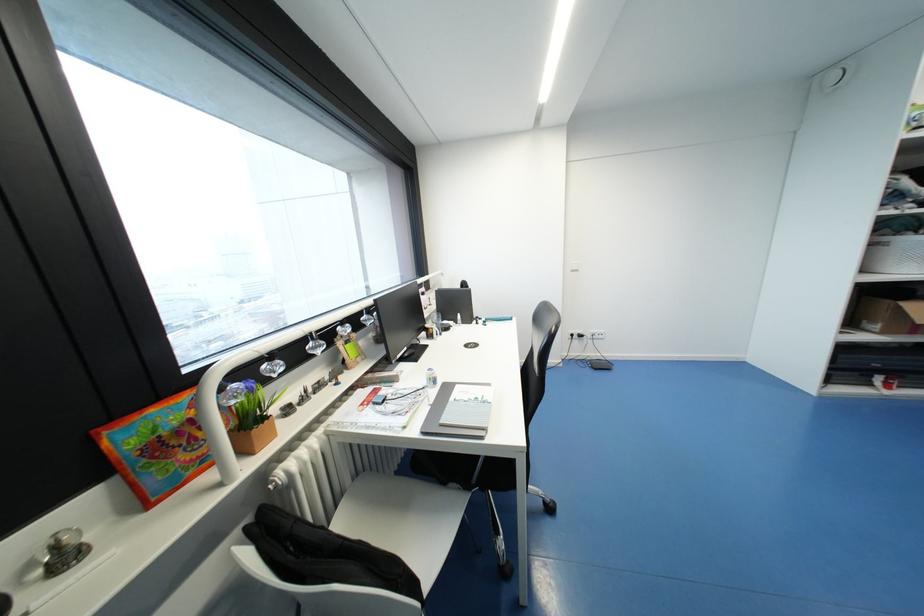
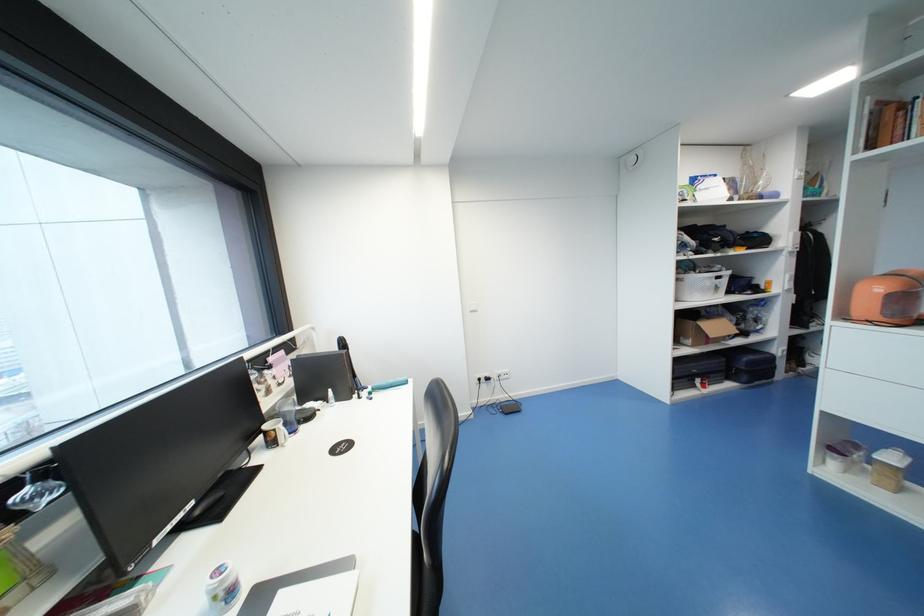
Which direction would the cameraman need to move to produce the second image?

The cameraman moved toward right, forward.